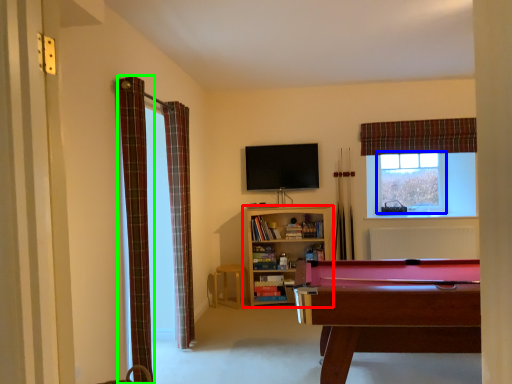
Question: Which is nearer to the bookcase (highlighted by a red box)? window frame (highlighted by a blue box) or curtain (highlighted by a green box).

Choices:
 (A) window frame
 (B) curtain

Answer: (A)